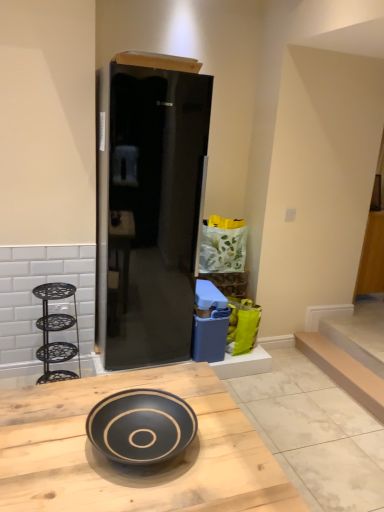
Question: In the image, is smooth beige stair at lower right positioned in front of or behind black matte bowl at center?

Choices:
 (A) behind
 (B) front

Answer: (A)

Question: From the image's perspective, is smooth beige stair at lower right positioned above or below black matte bowl at center?

Choices:
 (A) above
 (B) below

Answer: (A)

Question: Which is nearer to the black wrought iron shelving unit at left?

Choices:
 (A) smooth beige stair at lower right
 (B) black glass refrigerator at center
 (C) matte cardboard box at upper center
 (D) black glossy bowl at center
 (E) black matte bowl at center

Answer: (B)

Question: Which object is the closest to the black matte bowl at center?

Choices:
 (A) black wrought iron shelving unit at left
 (B) black glass refrigerator at center
 (C) matte cardboard box at upper center
 (D) smooth beige stair at lower right
 (E) black glossy bowl at center

Answer: (E)